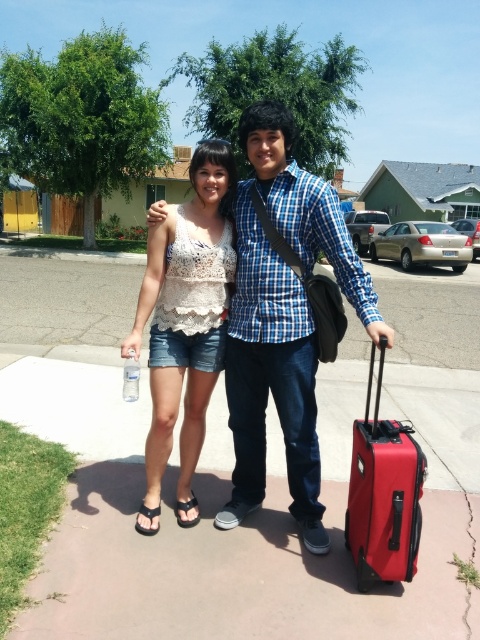
Is red matte suitcase at lower right closer to the viewer compared to clear plastic bottle at lower left?

Yes, it is.

Between red matte suitcase at lower right and clear plastic bottle at lower left, which one appears on the right side from the viewer's perspective?

red matte suitcase at lower right is more to the right.

The image size is (480, 640). I want to click on red matte suitcase at lower right, so click(384, 493).

Who is taller, clear plastic bottle at lower left or black fabric sandal at lower left?

Standing taller between the two is clear plastic bottle at lower left.

Is clear plastic bottle at lower left below black fabric sandal at lower left?

No.

Is point (130, 349) less distant than point (144, 515)?

Yes, point (130, 349) is in front of point (144, 515).

I want to click on clear plastic bottle at lower left, so click(131, 378).

Is white lace tank top at center to the left of black fabric sandal at lower left from the viewer's perspective?

No, white lace tank top at center is not to the left of black fabric sandal at lower left.

Consider the image. Is white lace tank top at center closer to camera compared to black fabric sandal at lower left?

That is True.

Find the location of a particular element. The image size is (480, 640). white lace tank top at center is located at coordinates (187, 312).

At what (x,y) coordinates should I click in order to perform the action: click on white lace tank top at center. Please return your answer as a coordinate pair (x, y). The height and width of the screenshot is (640, 480). Looking at the image, I should click on (187, 312).